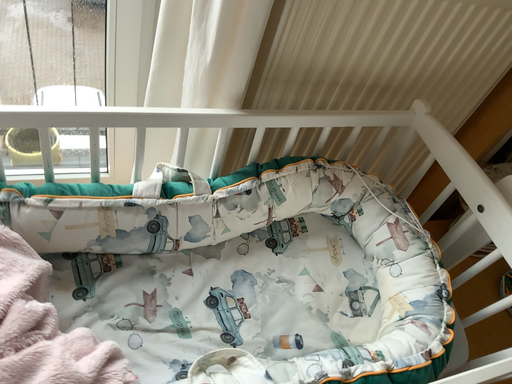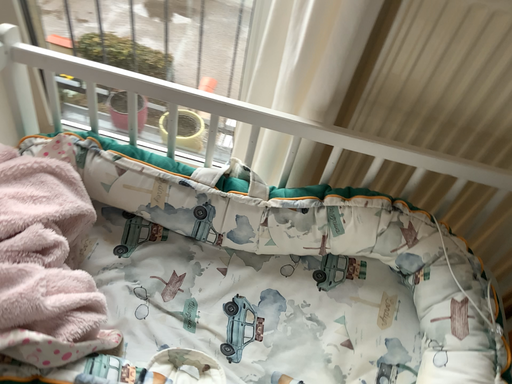
Question: How did the camera likely rotate when shooting the video?

Choices:
 (A) rotated left
 (B) rotated right

Answer: (A)